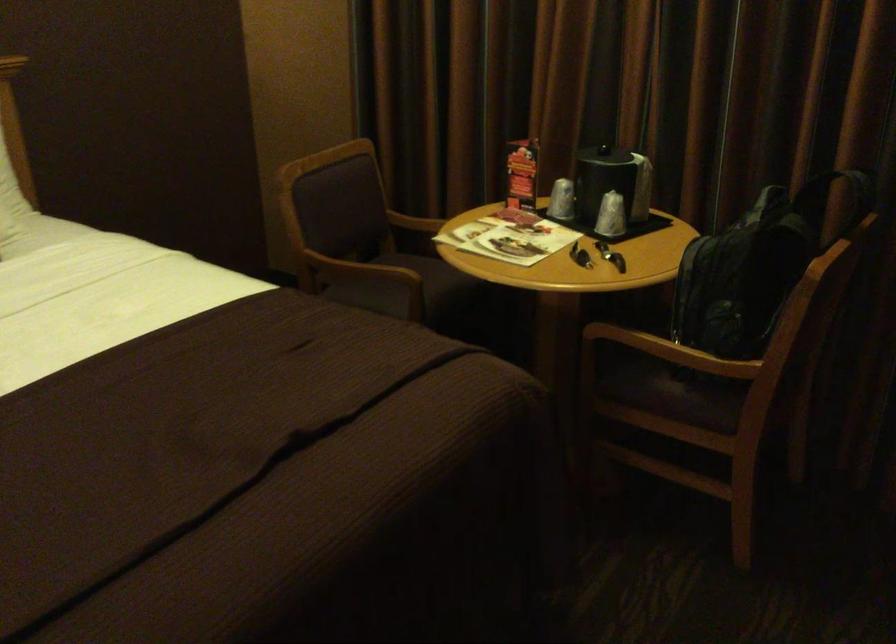
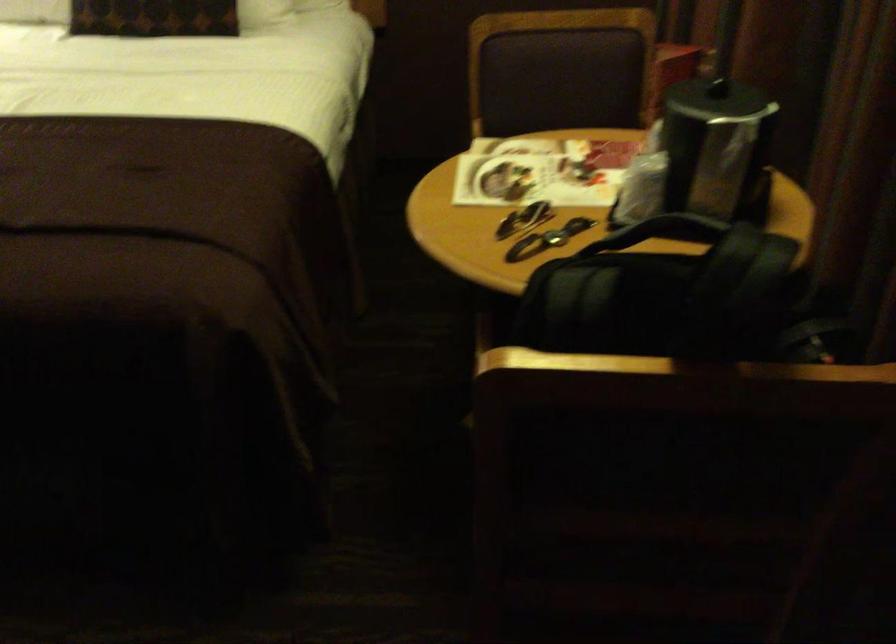
Question: I am providing you with two images of the same scene from different viewpoints. Please identify which objects are invisible in image2.

Choices:
 (A) chair armrest
 (B) chair sitting surface
 (C) backpack handle
 (D) book spine

Answer: (A)